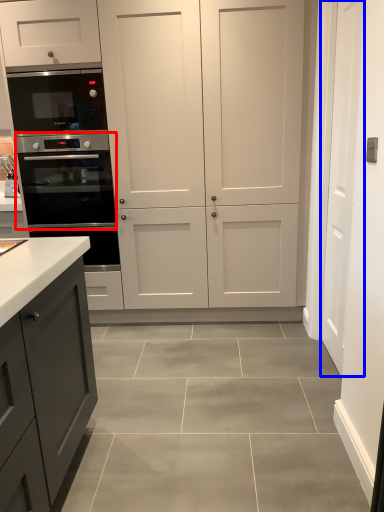
Question: Which object is further to the camera taking this photo, oven (highlighted by a red box) or door (highlighted by a blue box)?

Choices:
 (A) oven
 (B) door

Answer: (A)